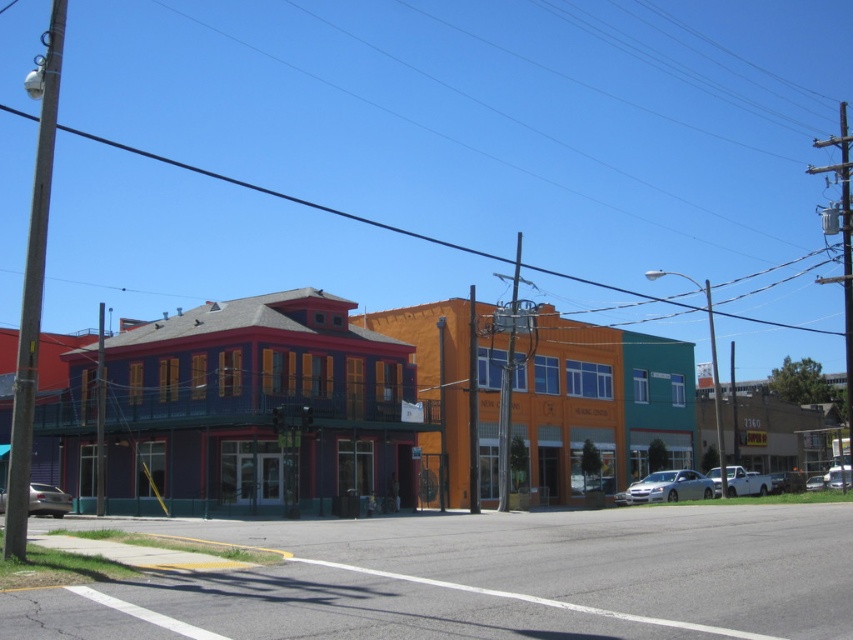
Question: Is purple matte building at left bigger than white matte truck at lower right?

Choices:
 (A) yes
 (B) no

Answer: (A)

Question: Among these points, which one is nearest to the camera?

Choices:
 (A) (68, 506)
 (B) (756, 481)
 (C) (329, 301)
 (D) (659, 500)

Answer: (A)

Question: Which point is farther from the camera taking this photo?

Choices:
 (A) (827, 566)
 (B) (671, 472)
 (C) (730, 488)

Answer: (C)

Question: Can you confirm if white matte truck at lower right is thinner than shiny silver sedan at lower right?

Choices:
 (A) yes
 (B) no

Answer: (B)

Question: Is purple matte building at left in front of asphalt road at lower center?

Choices:
 (A) no
 (B) yes

Answer: (A)

Question: Which point is farther to the camera?

Choices:
 (A) (44, 508)
 (B) (474, 604)

Answer: (A)